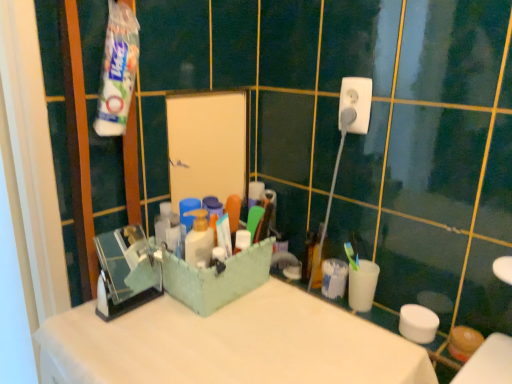
Question: Does point (375, 271) appear closer or farther from the camera than point (354, 110)?

Choices:
 (A) closer
 (B) farther

Answer: (B)

Question: Based on their sizes in the image, would you say white plastic cup at right is bigger or smaller than white plastic socket at upper right?

Choices:
 (A) small
 (B) big

Answer: (B)

Question: Estimate the real-world distances between objects in this image. Which object is closer to the white plastic cup at right?

Choices:
 (A) white plastic socket at upper right
 (B) white matte counter top at center

Answer: (B)

Question: Estimate the real-world distances between objects in this image. Which object is closer to the white plastic socket at upper right?

Choices:
 (A) white plastic cup at right
 (B) white matte counter top at center

Answer: (A)